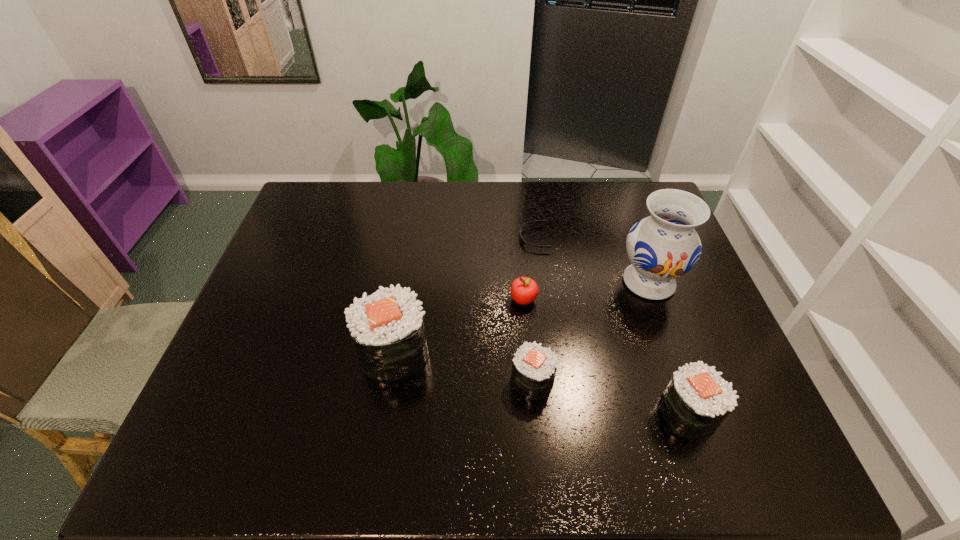
Find the location of `vacant region between the second tallest object and the apple`. vacant region between the second tallest object and the apple is located at coordinates (459, 326).

Find the location of a particular element. free space between the vase and the shortest object is located at coordinates (591, 260).

At what (x,y) coordinates should I click in order to perform the action: click on free point between the shortest object and the shortest sushi. Please return your answer as a coordinate pair (x, y). Image resolution: width=960 pixels, height=540 pixels. Looking at the image, I should click on (534, 309).

Find the location of a particular element. The image size is (960, 540). vacant space that's between the shortest object and the second sushi from left to right is located at coordinates (534, 309).

Identify which object is the fifth closest to the second shortest sushi. Please provide its 2D coordinates. Your answer should be formatted as a tuple, i.e. [(x, y)], where the tuple contains the x and y coordinates of a point satisfying the conditions above.

[(387, 327)]

The width and height of the screenshot is (960, 540). What are the coordinates of `object that is the fifth closest to the second tallest sushi` in the screenshot? It's located at (387, 327).

Locate which sushi is the closest to the second tallest object. Please provide its 2D coordinates. Your answer should be formatted as a tuple, i.e. [(x, y)], where the tuple contains the x and y coordinates of a point satisfying the conditions above.

[(534, 367)]

Choose which sushi is the third nearest neighbor to the apple. Please provide its 2D coordinates. Your answer should be formatted as a tuple, i.e. [(x, y)], where the tuple contains the x and y coordinates of a point satisfying the conditions above.

[(697, 399)]

Find the location of a particular element. The height and width of the screenshot is (540, 960). blank space that satisfies the following two spatial constraints: 1. on the back side of the apple; 2. on the right side of the leftmost sushi is located at coordinates (402, 300).